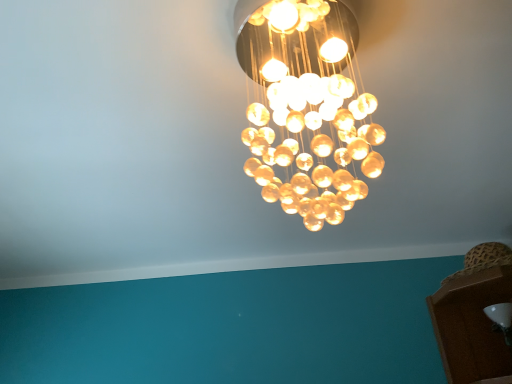
Where is `translucent glass chandelier at center`? The width and height of the screenshot is (512, 384). translucent glass chandelier at center is located at coordinates 308,107.

Image resolution: width=512 pixels, height=384 pixels. Describe the element at coordinates (308, 107) in the screenshot. I see `translucent glass chandelier at center` at that location.

Locate an element on the screen. This screenshot has width=512, height=384. translucent glass chandelier at center is located at coordinates (308, 107).